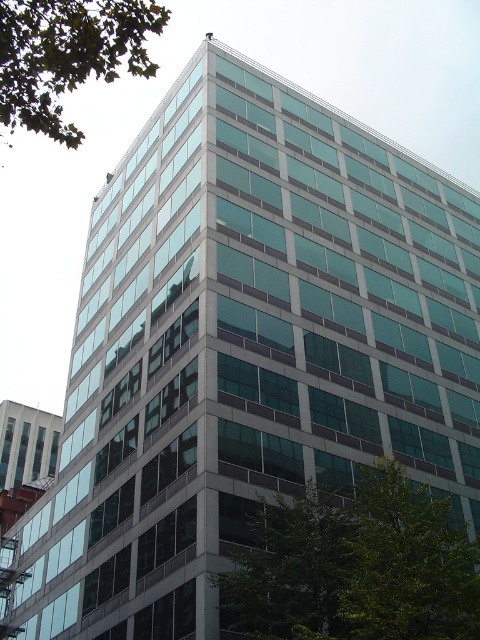
Does point (408, 502) lie in front of point (83, 132)?

Yes.

Who is higher up, green leafy tree at lower right or green leafy tree at upper left?

Positioned higher is green leafy tree at upper left.

Where is `green leafy tree at lower right`? The width and height of the screenshot is (480, 640). green leafy tree at lower right is located at coordinates (356, 564).

Locate an element on the screen. The image size is (480, 640). green leafy tree at lower right is located at coordinates (356, 564).